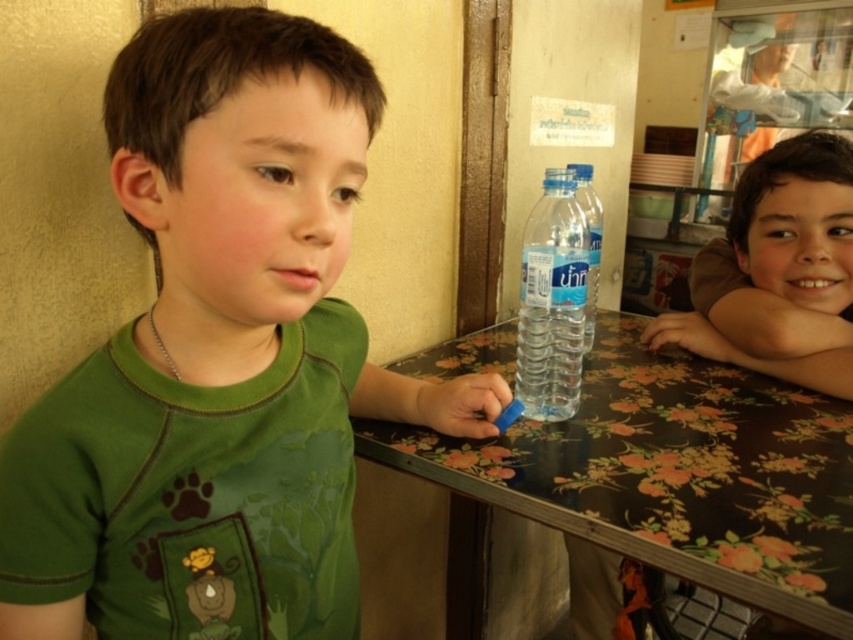
Which is in front, point (519, 492) or point (836, 278)?

Point (519, 492) is more forward.

Consider the image. Which is below, floral-patterned wood at center or brown matte face at upper right?

floral-patterned wood at center is lower down.

This screenshot has width=853, height=640. Describe the element at coordinates (672, 474) in the screenshot. I see `floral-patterned wood at center` at that location.

In order to click on floral-patterned wood at center in this screenshot , I will do `click(672, 474)`.

Is green matte shirt at left smaller than floral-patterned wood at center?

Yes, green matte shirt at left is smaller than floral-patterned wood at center.

Is green matte shirt at left above floral-patterned wood at center?

Indeed, green matte shirt at left is positioned over floral-patterned wood at center.

What do you see at coordinates (218, 317) in the screenshot? This screenshot has width=853, height=640. I see `green matte shirt at left` at bounding box center [218, 317].

Identify the location of green matte shirt at left. (218, 317).

Looking at this image, which of these two, floral-patterned wood at center or clear plastic bottle at center, stands taller?

With more height is clear plastic bottle at center.

Which of these two, floral-patterned wood at center or clear plastic bottle at center, stands shorter?

floral-patterned wood at center

This screenshot has width=853, height=640. I want to click on floral-patterned wood at center, so click(x=672, y=474).